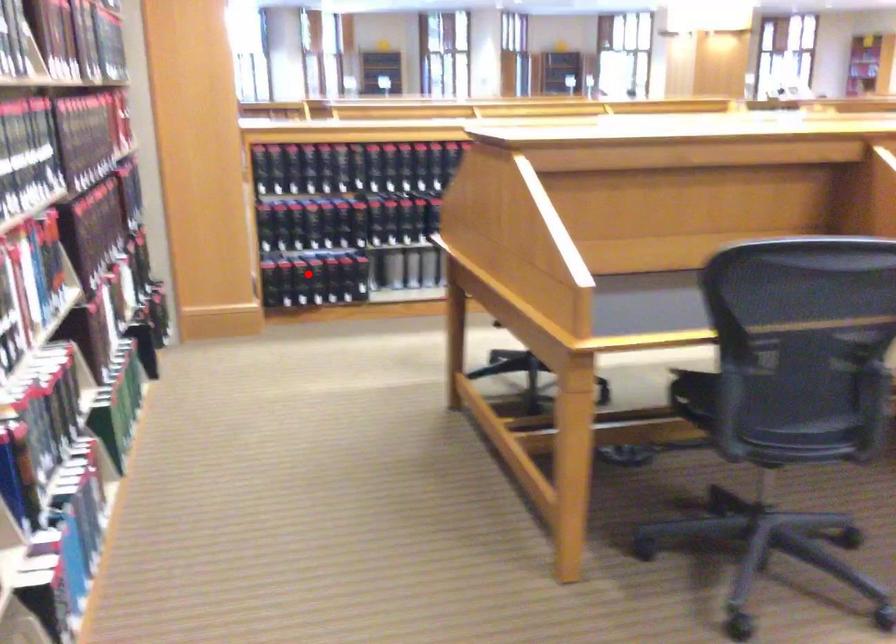
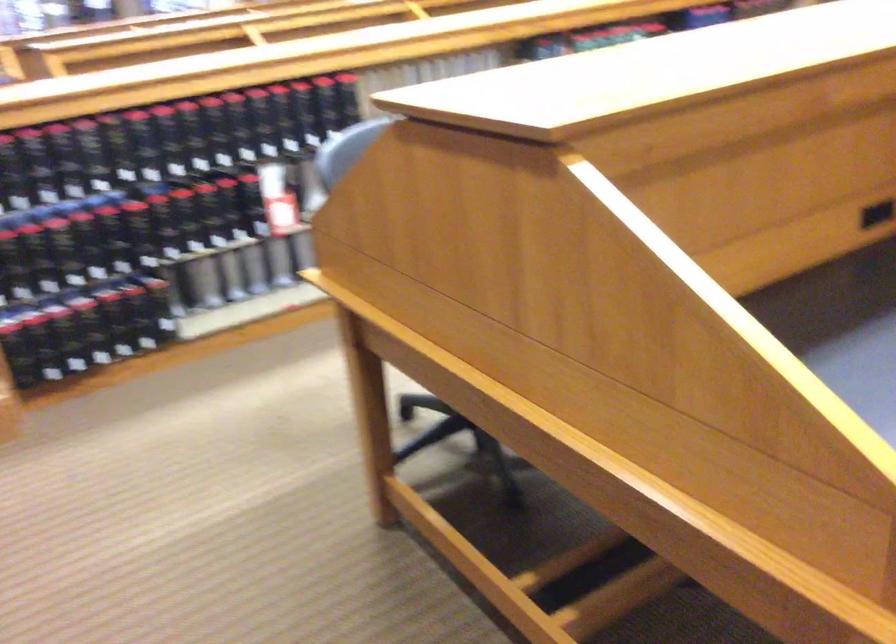
Question: I am providing you with two images of the same scene from different viewpoints. Given a red point in image1, look at the same physical point in image2. Is it:

Choices:
 (A) Closer to the viewpoint
 (B) Farther from the viewpoint

Answer: (A)